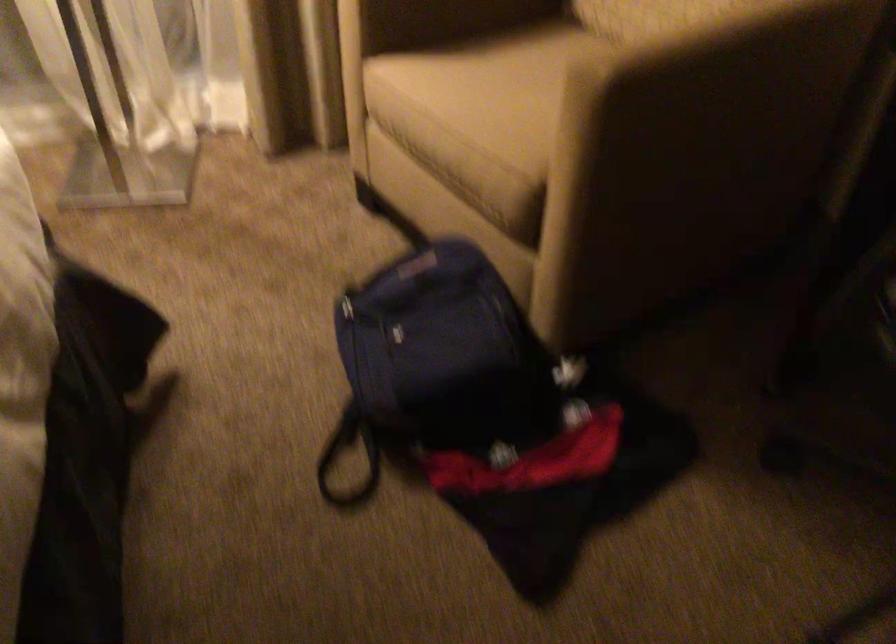
You are a GUI agent. You are given a task and a screenshot of the screen. Output one action in this format:
    pyautogui.click(x=<x>, y=<y>)
    Task: Click on the chair sitting surface
    This screenshot has height=644, width=896.
    Given the screenshot: What is the action you would take?
    pyautogui.click(x=493, y=73)